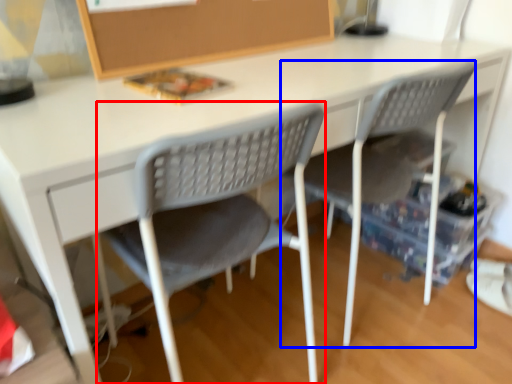
Question: Which point is further to the camera, chair (highlighted by a red box) or chair (highlighted by a blue box)?

Choices:
 (A) chair
 (B) chair

Answer: (B)